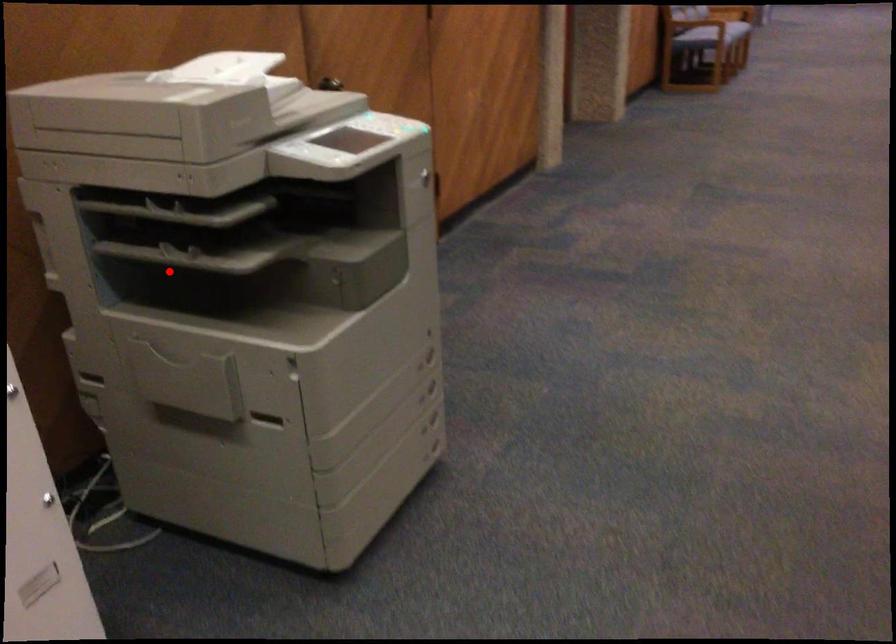
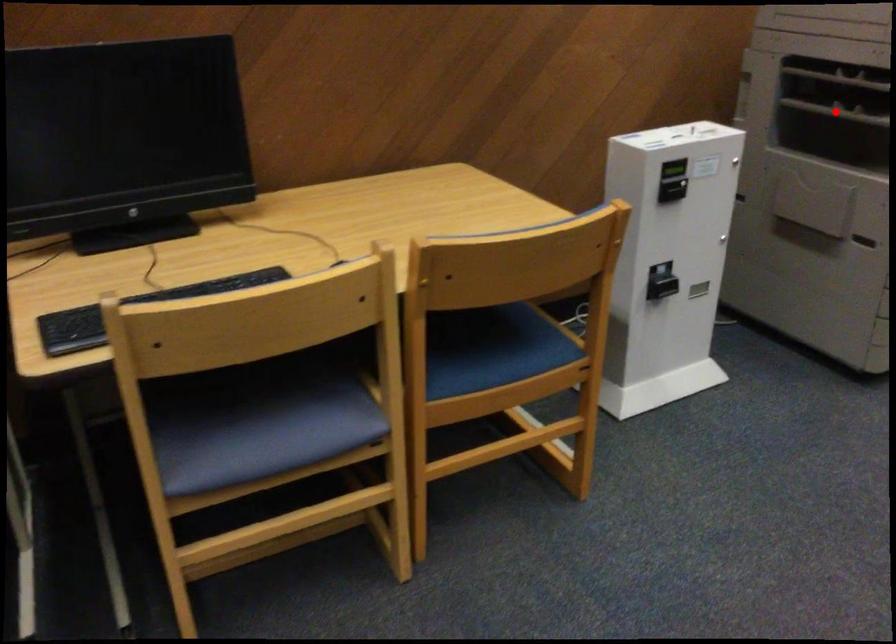
I am providing you with two images of the same scene from different viewpoints. A red point is marked on the first image and another point is marked on the second image. Do the highlighted points in image1 and image2 indicate the same real-world spot?

Yes